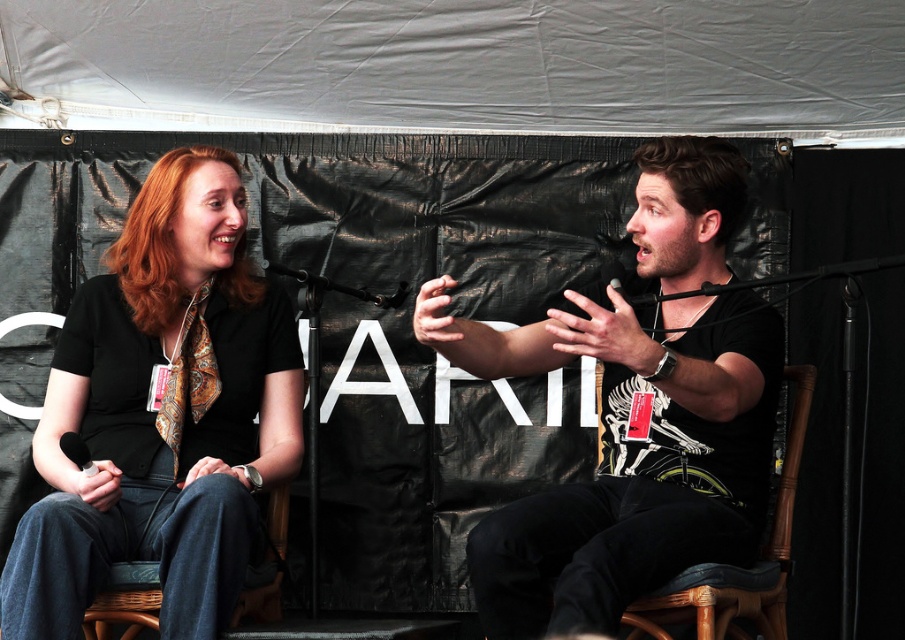
Question: Considering the real-world distances, which object is closest to the black matte microphone at center?

Choices:
 (A) denim fabric chair at lower left
 (B) wicker chair at right
 (C) black matte t-shirt at center

Answer: (A)

Question: Which object is the closest to the black matte t-shirt at center?

Choices:
 (A) black matte microphone at center
 (B) matte black shirt at center
 (C) wicker chair at right

Answer: (C)

Question: Which point appears closest to the camera in this image?

Choices:
 (A) (798, 432)
 (B) (264, 576)
 (C) (300, 272)
 (D) (125, 344)

Answer: (B)

Question: Can you confirm if denim fabric chair at lower left is bigger than black matte microphone at center?

Choices:
 (A) no
 (B) yes

Answer: (B)

Question: Can you confirm if wicker chair at right is wider than denim fabric chair at lower left?

Choices:
 (A) no
 (B) yes

Answer: (B)

Question: Is matte black shirt at center above black matte t-shirt at center?

Choices:
 (A) no
 (B) yes

Answer: (A)